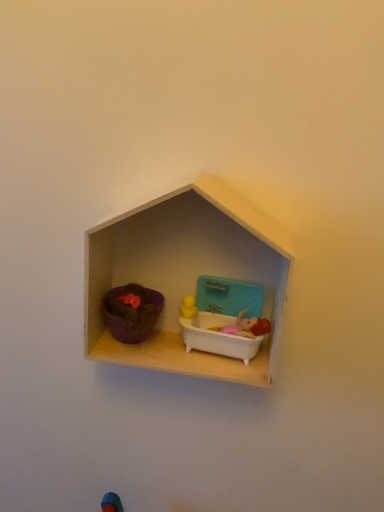
Question: Is white plastic bathtub at center, which is the second toy from left to right, aimed at wooden dollhouse at center?

Choices:
 (A) no
 (B) yes

Answer: (B)

Question: Is white plastic bathtub at center, the 1th toy viewed from the right, in contact with wooden dollhouse at center?

Choices:
 (A) no
 (B) yes

Answer: (B)

Question: Can you confirm if white plastic bathtub at center, the 1th toy viewed from the right, is shorter than wooden dollhouse at center?

Choices:
 (A) no
 (B) yes

Answer: (B)

Question: From a real-world perspective, is white plastic bathtub at center, the 1th toy viewed from the right, located beneath wooden dollhouse at center?

Choices:
 (A) yes
 (B) no

Answer: (A)

Question: Can you confirm if white plastic bathtub at center, which is the second toy from left to right, is smaller than wooden dollhouse at center?

Choices:
 (A) no
 (B) yes

Answer: (B)

Question: Is matte purple pot at left, which appears as the 1th toy when viewed from the left, completely or partially inside wooden dollhouse at center?

Choices:
 (A) yes
 (B) no

Answer: (A)

Question: Is wooden dollhouse at center touching matte purple pot at left, positioned as the 2th toy in right-to-left order?

Choices:
 (A) yes
 (B) no

Answer: (A)

Question: Is wooden dollhouse at center facing away from matte purple pot at left, positioned as the 2th toy in right-to-left order?

Choices:
 (A) no
 (B) yes

Answer: (B)

Question: Is wooden dollhouse at center facing towards matte purple pot at left, positioned as the 2th toy in right-to-left order?

Choices:
 (A) no
 (B) yes

Answer: (B)

Question: Considering the relative positions of wooden dollhouse at center and matte purple pot at left, which appears as the 1th toy when viewed from the left, in the image provided, is wooden dollhouse at center to the left of matte purple pot at left, which appears as the 1th toy when viewed from the left, from the viewer's perspective?

Choices:
 (A) yes
 (B) no

Answer: (B)

Question: From the image's perspective, is wooden dollhouse at center located beneath matte purple pot at left, positioned as the 2th toy in right-to-left order?

Choices:
 (A) no
 (B) yes

Answer: (A)

Question: Does white plastic bathtub at center, the 1th toy viewed from the right, have a greater width compared to matte purple pot at left, positioned as the 2th toy in right-to-left order?

Choices:
 (A) no
 (B) yes

Answer: (A)